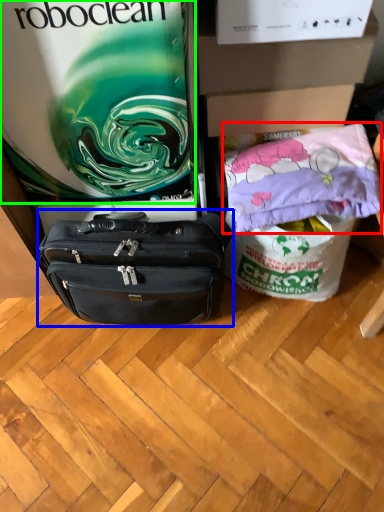
Question: Based on their relative distances, which object is nearer to material (highlighted by a red box)? Choose from luggage and bags (highlighted by a blue box) and gift bag (highlighted by a green box).

Choices:
 (A) luggage and bags
 (B) gift bag

Answer: (A)